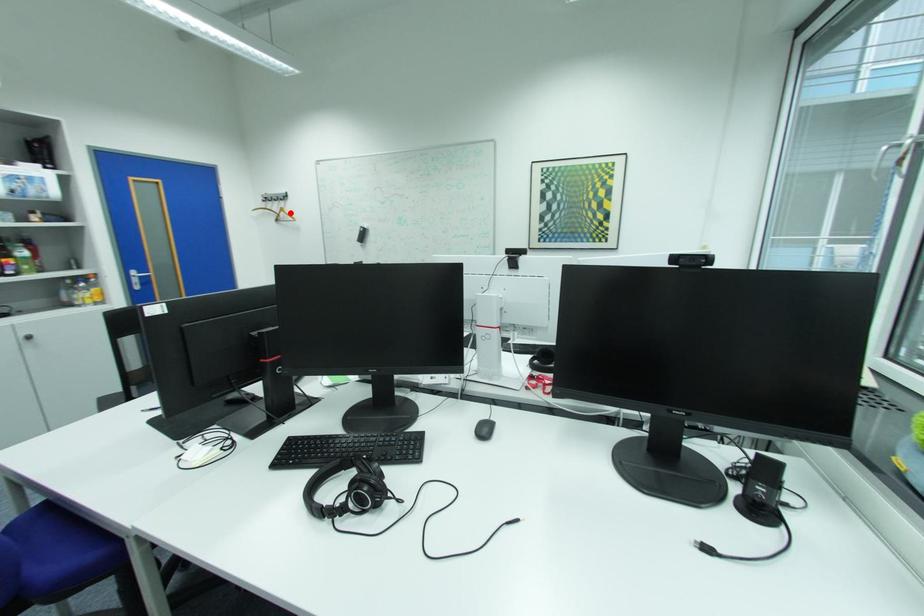
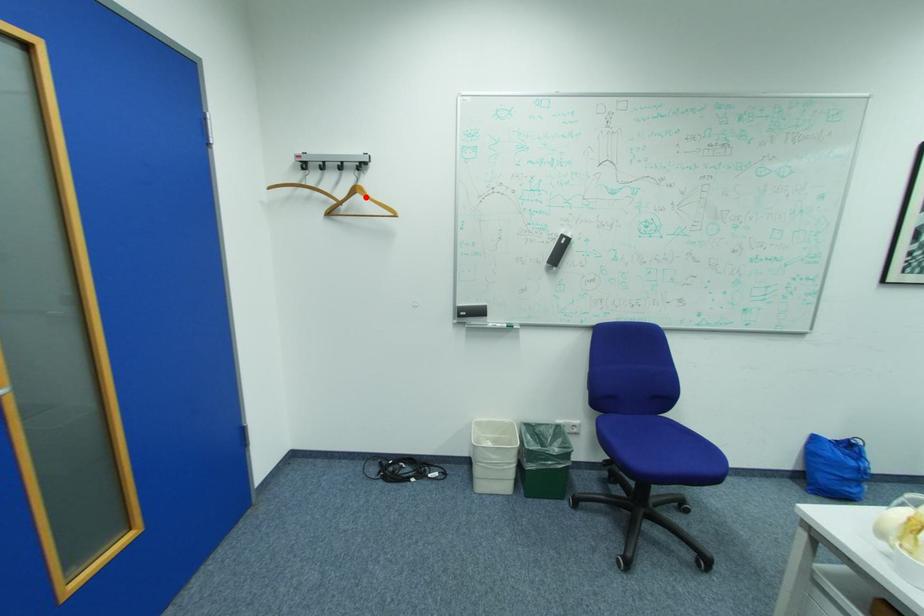
I am providing you with two images of the same scene from different viewpoints. A red point is marked on the first image and another point is marked on the second image. Does the point marked in image1 correspond to the same location as the one in image2?

Yes